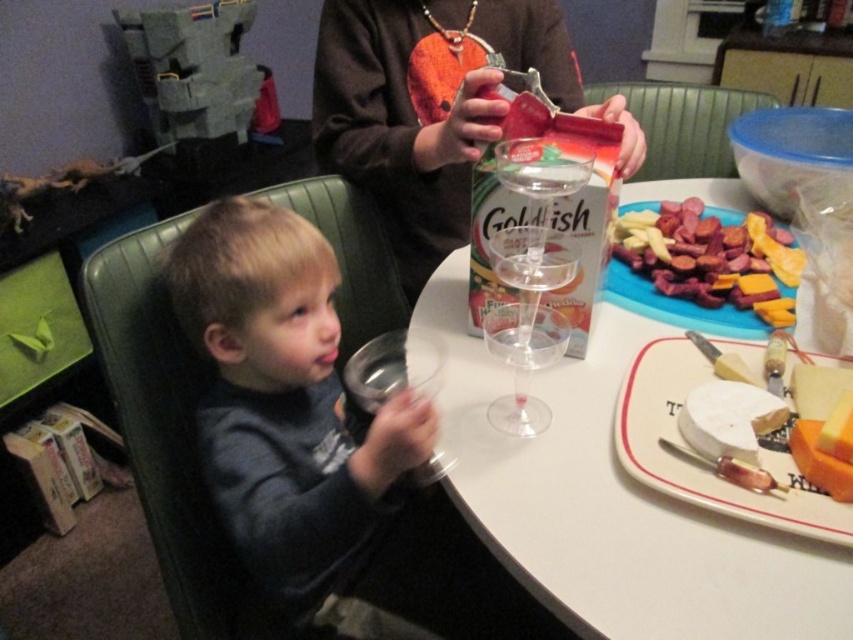
You are standing at a point 1.17 meters away from the camera. Can you see the point labeled as point (450, 33) in the image?

Yes, since you are standing at a point 1.17 meters away from the camera, you can see the point labeled as point (450, 33) in the image.